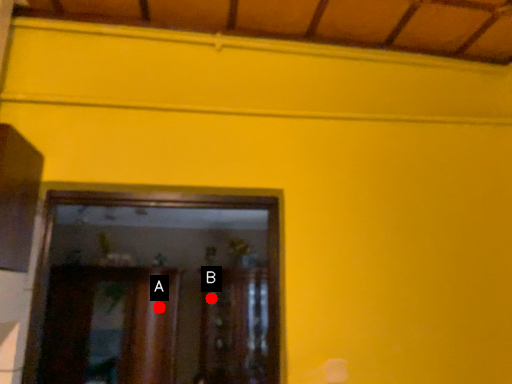
Question: Two points are circled on the image, labeled by A and B beside each circle. Which point is further to the camera?

Choices:
 (A) A is further
 (B) B is further

Answer: (B)